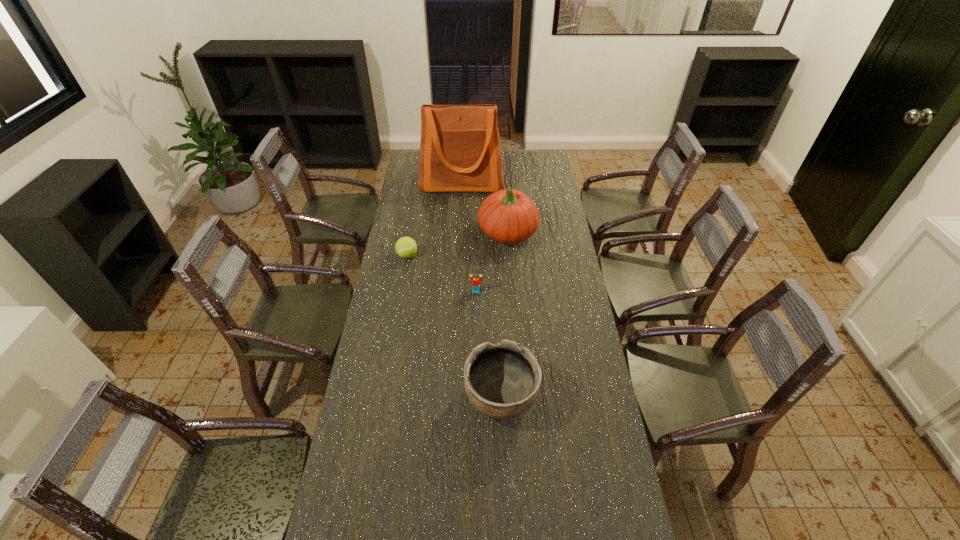
The image size is (960, 540). Find the location of `free space that is in between the third tallest object and the tennis ball`. free space that is in between the third tallest object and the tennis ball is located at coordinates (454, 327).

Locate an element on the screen. empty space that is in between the tennis ball and the third tallest object is located at coordinates point(454,327).

At what (x,y) coordinates should I click in order to perform the action: click on unoccupied area between the third tallest object and the pumpkin. Please return your answer as a coordinate pair (x, y). The height and width of the screenshot is (540, 960). Looking at the image, I should click on (504, 315).

In order to click on vacant area that lies between the shopping bag and the nearest object in this screenshot , I will do `click(481, 290)`.

Image resolution: width=960 pixels, height=540 pixels. I want to click on free spot between the tennis ball and the shopping bag, so click(x=435, y=219).

Where is `free space between the tennis ball and the Lego`? The width and height of the screenshot is (960, 540). free space between the tennis ball and the Lego is located at coordinates (442, 273).

Identify the location of vacant space in between the nearest object and the tennis ball. (454, 327).

Choose which object is the fourth nearest neighbor to the Lego. Please provide its 2D coordinates. Your answer should be formatted as a tuple, i.e. [(x, y)], where the tuple contains the x and y coordinates of a point satisfying the conditions above.

[(460, 151)]

Select which object is the closest to the shopping bag. Please provide its 2D coordinates. Your answer should be formatted as a tuple, i.e. [(x, y)], where the tuple contains the x and y coordinates of a point satisfying the conditions above.

[(509, 216)]

Identify the location of free space in the image that satisfies the following two spatial constraints: 1. on the front pocket of the nearest object; 2. on the left side of the shopping bag. (450, 397).